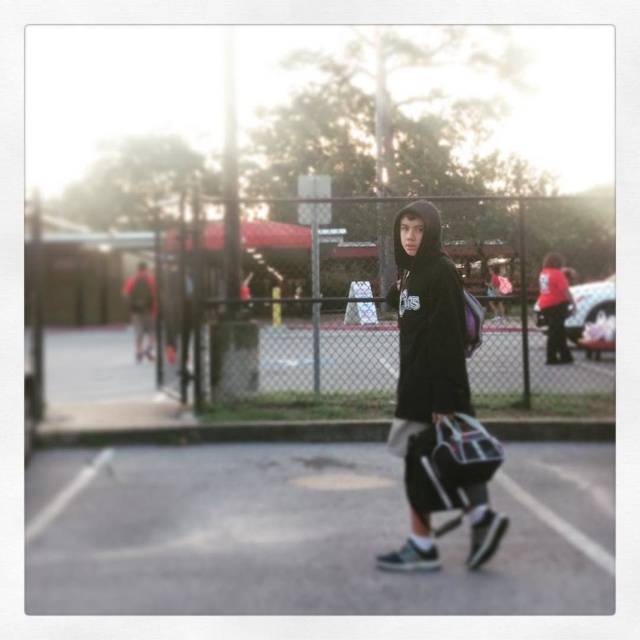
Question: Which point appears farthest from the camera in this image?

Choices:
 (A) (436, 305)
 (B) (147, 308)

Answer: (B)

Question: Where is black fleece sweatshirt at center located in relation to matte black hoodie at center in the image?

Choices:
 (A) above
 (B) below

Answer: (B)

Question: Is black fleece hoodie at center to the right of matte black hoodie at center from the viewer's perspective?

Choices:
 (A) yes
 (B) no

Answer: (A)

Question: Which object is farther from the camera taking this photo?

Choices:
 (A) black fleece hoodie at center
 (B) black fleece sweatshirt at center

Answer: (B)

Question: Which of the following is the closest to the observer?

Choices:
 (A) black fleece hoodie at center
 (B) black fleece sweatshirt at center

Answer: (A)

Question: Does black fleece hoodie at center appear over matte black hoodie at center?

Choices:
 (A) yes
 (B) no

Answer: (B)